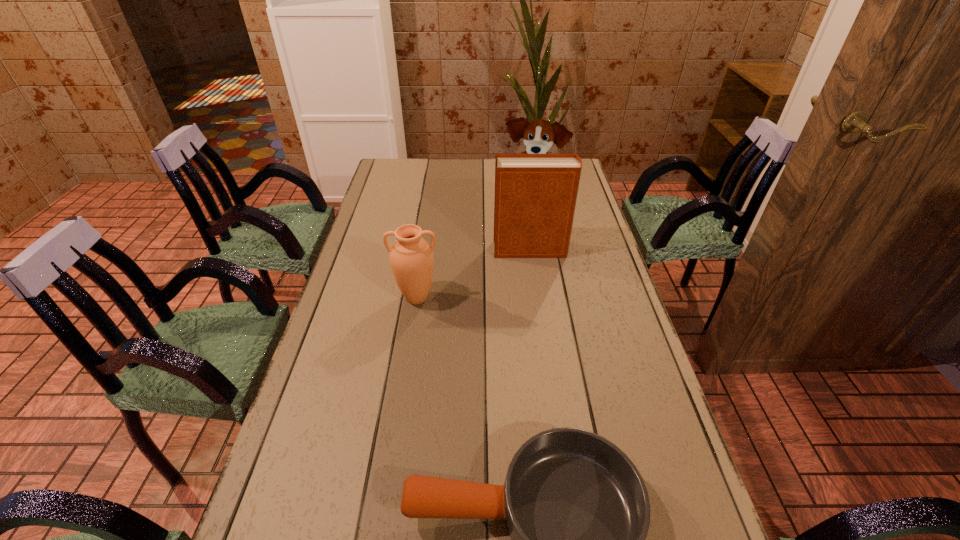
Where is `puppy`? This screenshot has height=540, width=960. puppy is located at coordinates (539, 135).

Find the location of `the second farthest object`. the second farthest object is located at coordinates (535, 194).

Where is `urn`? urn is located at coordinates (411, 257).

Identify the location of the second shortest object. (411, 257).

Locate an element on the screen. Image resolution: width=960 pixels, height=540 pixels. vacant region located on the face of the puppy is located at coordinates click(546, 286).

Locate an element on the screen. This screenshot has height=540, width=960. free region located on the open cover of the third nearest object is located at coordinates pyautogui.click(x=408, y=250).

In order to click on vacant space positioned on the open cover of the third nearest object in this screenshot , I will do `click(470, 250)`.

Image resolution: width=960 pixels, height=540 pixels. I want to click on vacant space located 0.190m on the open cover of the third nearest object, so click(x=438, y=250).

Locate an element on the screen. The image size is (960, 540). free point located 0.360m on the back of the third farthest object is located at coordinates (429, 219).

Where is `puppy at the right edge`? This screenshot has height=540, width=960. puppy at the right edge is located at coordinates (539, 135).